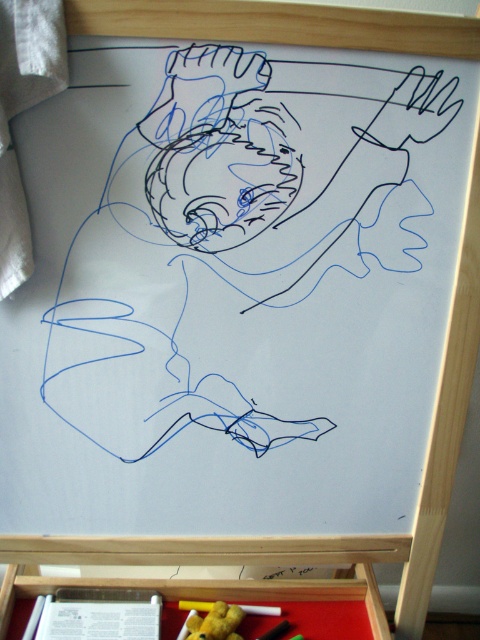
You are organizing the art supplies on the red matte drawer at lower center and the yellow matte crayon at lower center. If you want to place the crayon to the right of the drawer, is it already positioned correctly?

Yes, the yellow matte crayon at lower center is already to the right of the red matte drawer at lower center, so it is correctly positioned.